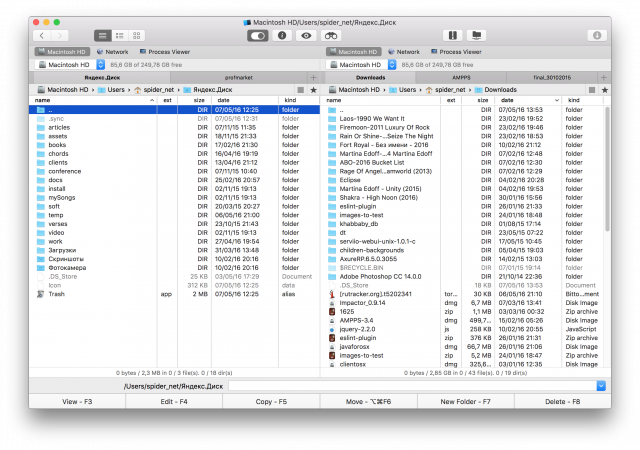
Locate an element on the screen. Image resolution: width=640 pixels, height=450 pixels. files is located at coordinates (354, 290), (351, 301), (351, 308), (354, 320), (355, 328), (355, 337), (354, 345), (354, 353), (354, 363).